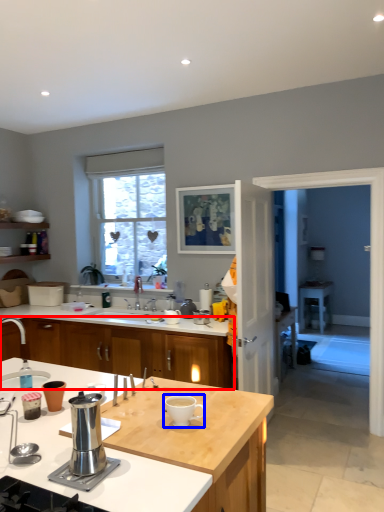
Question: Which object appears farthest to the camera in this image, cabinetry (highlighted by a red box) or coffee cup (highlighted by a blue box)?

Choices:
 (A) cabinetry
 (B) coffee cup

Answer: (A)